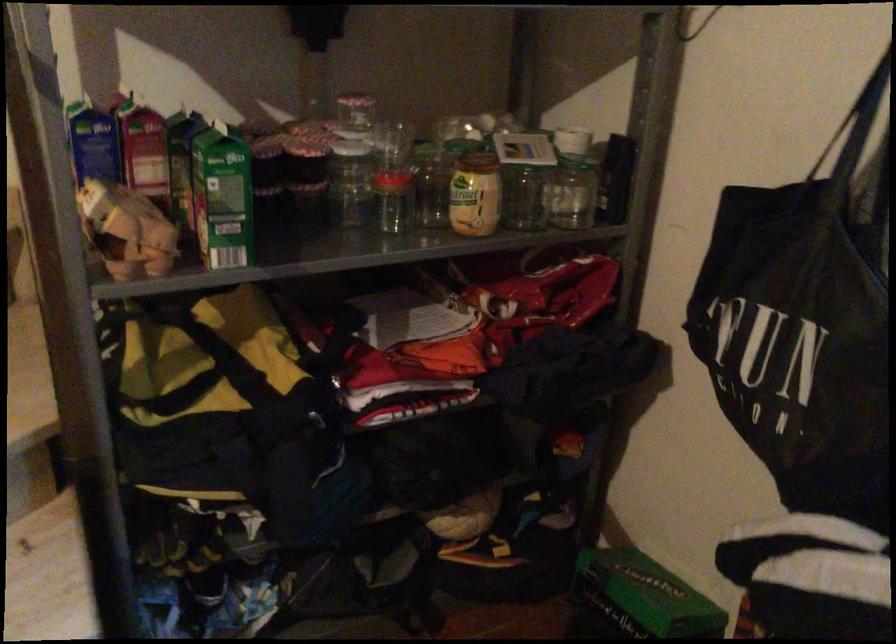
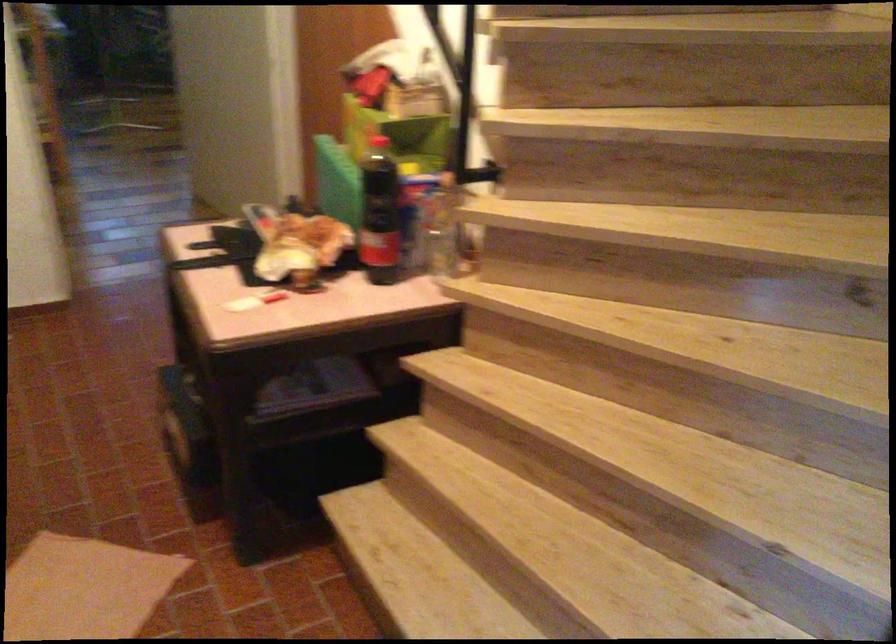
The first image is from the beginning of the video and the second image is from the end. How did the camera likely rotate when shooting the video?

The camera's rotation is toward left-down.